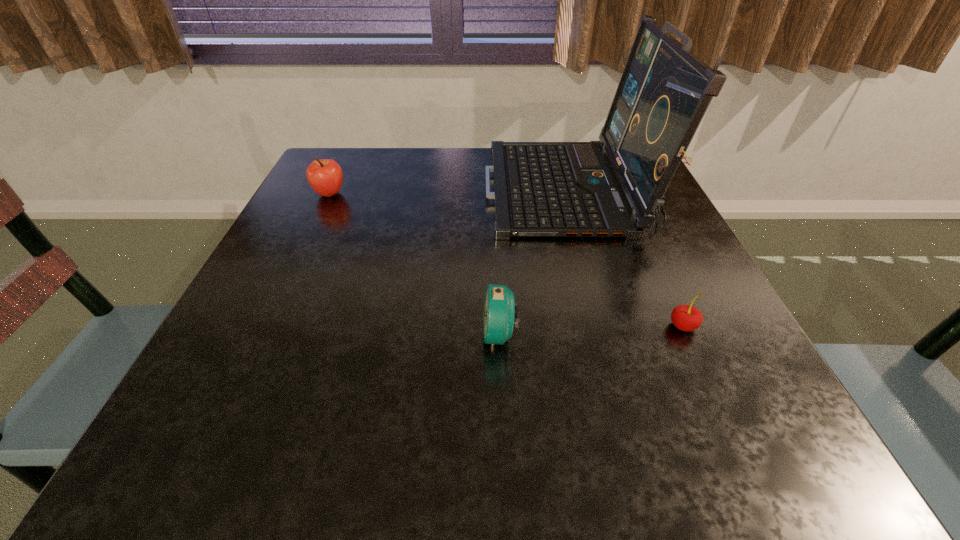
Identify the location of the tallest object. pos(541,189).

Where is `alarm clock`? The width and height of the screenshot is (960, 540). alarm clock is located at coordinates (499, 307).

The width and height of the screenshot is (960, 540). I want to click on apple, so click(325, 176).

Find the location of a particular element. This screenshot has width=960, height=540. cherry is located at coordinates (687, 318).

At what (x,y) coordinates should I click in order to perform the action: click on blank space located 0.220m on the front-facing side of the laptop computer. Please return your answer as a coordinate pair (x, y). Looking at the image, I should click on (392, 192).

Find the location of a particular element. vacant space located on the front-facing side of the laptop computer is located at coordinates (x=362, y=192).

Where is `vacant space located on the front-facing side of the laptop computer`? vacant space located on the front-facing side of the laptop computer is located at coordinates (348, 192).

The height and width of the screenshot is (540, 960). Identify the location of vacant region located on the front-facing side of the alarm clock. (346, 335).

The image size is (960, 540). In order to click on free spot located 0.370m on the front-facing side of the alarm clock in this screenshot , I will do `click(252, 335)`.

Where is `vacant space located on the front-facing side of the alarm clock`? vacant space located on the front-facing side of the alarm clock is located at coordinates (308, 335).